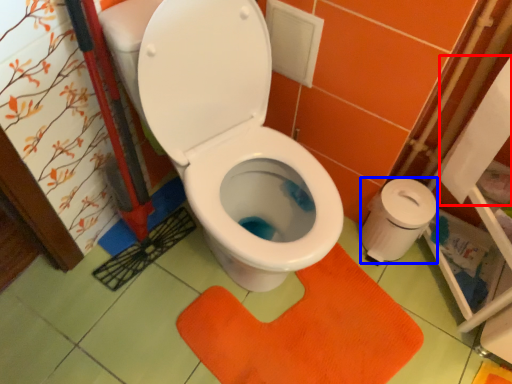
Question: Which point is further to the camera, toilet paper (highlighted by a red box) or toilet paper (highlighted by a blue box)?

Choices:
 (A) toilet paper
 (B) toilet paper

Answer: (B)